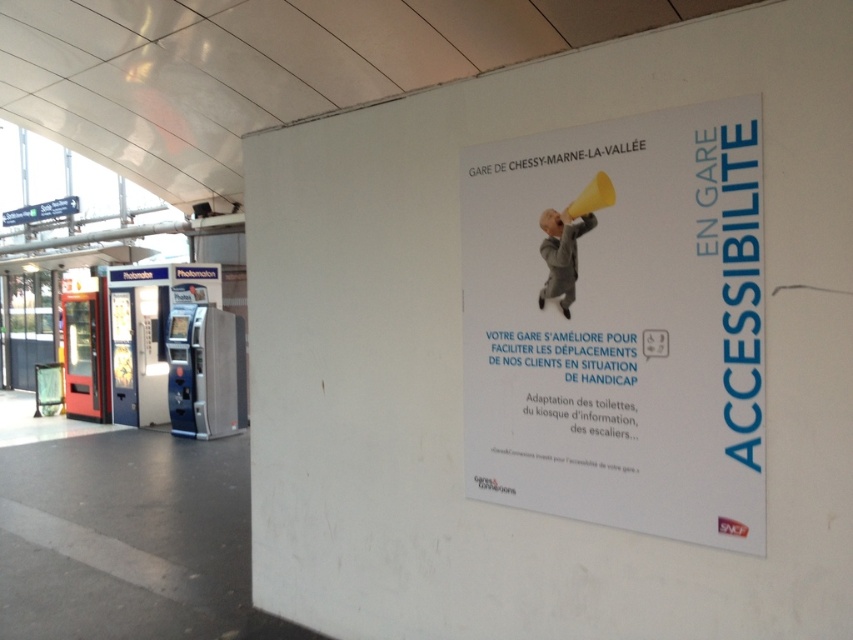
You are a traveler at the train station and you want to read the accessibility information on the white paper poster at center. However, there is a light gray fabric at center blocking your view. Can you see the entire poster?

The white paper poster at center is wider than the light gray fabric at center, so part of the poster is visible beyond the fabric.

Consider the image. You are standing at the train station and want to know which of the two points, point [675,284] or point [581,225], is closer to you. Based on the scene description, can you determine which point is nearer?

Point [675,284] is in front of point [581,225], so it is closer to you.

From the picture: You are a traveler standing at the Gare de Chessy platform and need to place a small note on the wall between the white paper poster at center and the light gray fabric at center. The note is 10 centimeters wide. Can you fit it without overlapping either object?

The distance between the white paper poster at center and the light gray fabric at center is 27.05 centimeters. Since the note is only 10 centimeters wide, there is enough space to place it between them without overlapping either object.